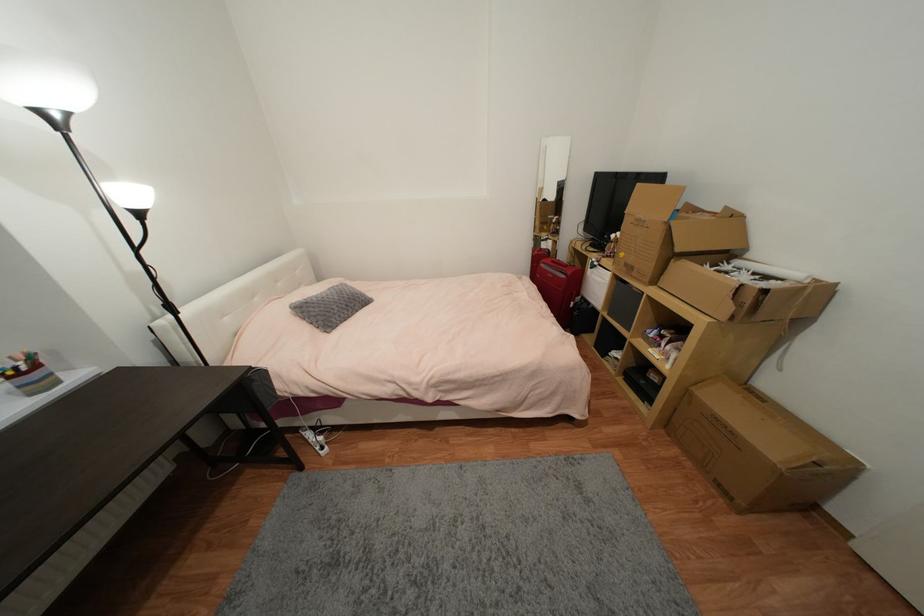
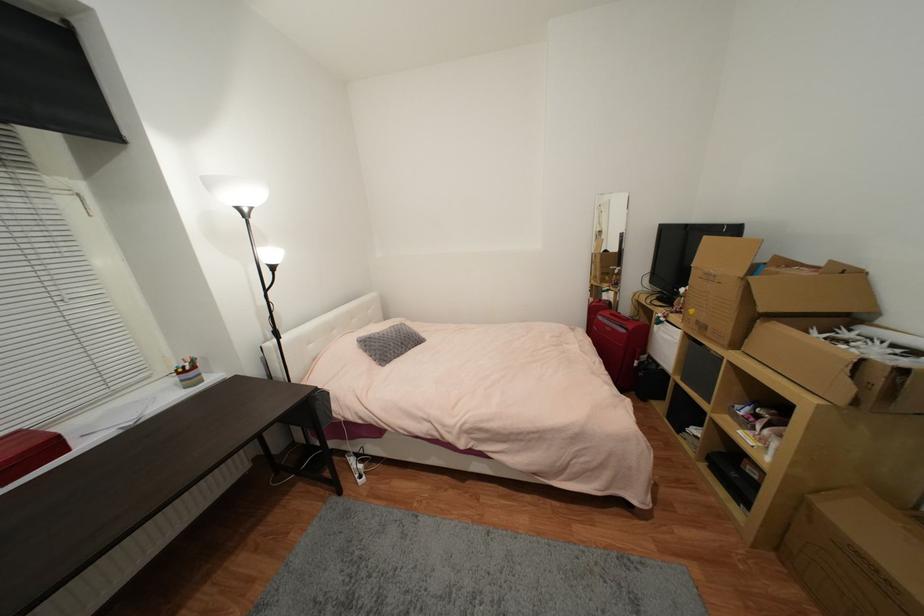
In the second image, find the point that corresponds to point (734, 310) in the first image.

(852, 390)